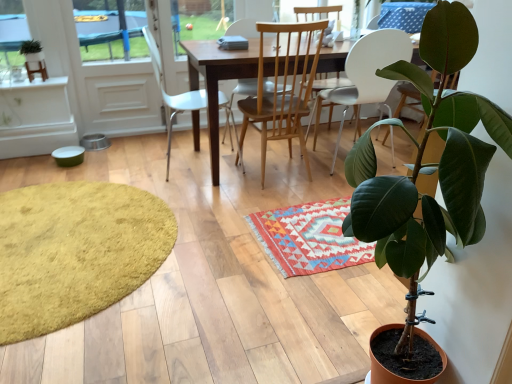
Where is `white plastic chair at center, acting as the 3th chair starting from the right`? white plastic chair at center, acting as the 3th chair starting from the right is located at coordinates (173, 95).

In order to face green matte plant at lower right, which is counted as the 1th houseplant, starting from the right, should I rotate leftwards or rightwards?

It's best to rotate right around 19.354 degrees.

This screenshot has width=512, height=384. What do you see at coordinates (441, 155) in the screenshot?
I see `green matte plant at lower right, the second houseplant from the back` at bounding box center [441, 155].

Identify the location of multicolored woven rug at center, marked as the 2th mat in a left-to-right arrangement. This screenshot has width=512, height=384. (309, 238).

Describe the element at coordinates (309, 238) in the screenshot. The image size is (512, 384). I see `multicolored woven rug at center, which appears as the 1th mat when viewed from the right` at that location.

The image size is (512, 384). Describe the element at coordinates (75, 252) in the screenshot. I see `yellow shaggy rug at lower left, which ranks as the 1th mat in left-to-right order` at that location.

This screenshot has width=512, height=384. What do you see at coordinates (365, 77) in the screenshot? I see `white plastic chair at center, which is the first chair in right-to-left order` at bounding box center [365, 77].

What is the approximate width of green matte plant at upper left, the first houseplant from the top?

3.26 inches.

I want to click on light wood/wooden chair at center, which is counted as the 2th chair, starting from the right, so click(x=282, y=86).

Is white plastic chair at center, positioned as the 3th chair in left-to-right order, beside green matte plant at upper left, the 2th houseplant positioned from the bottom?

No, white plastic chair at center, positioned as the 3th chair in left-to-right order, is not in contact with green matte plant at upper left, the 2th houseplant positioned from the bottom.

Does white plastic chair at center, positioned as the 3th chair in left-to-right order, have a larger size compared to green matte plant at upper left, the 2th houseplant positioned from the bottom?

Yes.

Considering the sizes of white plastic chair at center, which is the first chair in right-to-left order, and green matte plant at upper left, the 2th houseplant viewed from the front, in the image, is white plastic chair at center, which is the first chair in right-to-left order, taller or shorter than green matte plant at upper left, the 2th houseplant viewed from the front,?

In the image, white plastic chair at center, which is the first chair in right-to-left order, appears to be taller than green matte plant at upper left, the 2th houseplant viewed from the front.

Consider the image. From the image's perspective, is white plastic chair at center, which is the first chair in right-to-left order, located above or below green matte plant at upper left, the 2th houseplant viewed from the front?

Clearly, from the image's perspective, white plastic chair at center, which is the first chair in right-to-left order, is below green matte plant at upper left, the 2th houseplant viewed from the front.

Is point (353, 51) farther from camera compared to point (111, 111)?

No, it is not.

Between white plastic chair at center, which is the first chair in right-to-left order, and white glossy screen door at upper left, which one has larger size?

white plastic chair at center, which is the first chair in right-to-left order, is bigger.

Which object is closer to the camera, white plastic chair at center, positioned as the 3th chair in left-to-right order, or white glossy screen door at upper left?

white plastic chair at center, positioned as the 3th chair in left-to-right order, is more forward.

Is white plastic chair at center, positioned as the 3th chair in left-to-right order, in contact with white glossy screen door at upper left?

white plastic chair at center, positioned as the 3th chair in left-to-right order, and white glossy screen door at upper left are clearly separated.

Considering the relative sizes of white glossy screen door at upper left and light wood/wooden chair at center, acting as the 2th chair starting from the left, in the image provided, is white glossy screen door at upper left thinner than light wood/wooden chair at center, acting as the 2th chair starting from the left,?

Indeed, white glossy screen door at upper left has a lesser width compared to light wood/wooden chair at center, acting as the 2th chair starting from the left.

Based on the photo, between white glossy screen door at upper left and light wood/wooden chair at center, acting as the 2th chair starting from the left, which one appears on the right side from the viewer's perspective?

light wood/wooden chair at center, acting as the 2th chair starting from the left.

How many degrees apart are the facing directions of white glossy screen door at upper left and light wood/wooden chair at center, acting as the 2th chair starting from the left?

177 degrees.

Considering the relative sizes of yellow shaggy rug at lower left, which ranks as the 1th mat in left-to-right order, and white glossy screen door at upper left in the image provided, is yellow shaggy rug at lower left, which ranks as the 1th mat in left-to-right order, wider than white glossy screen door at upper left?

Yes.

Based on the photo, is yellow shaggy rug at lower left, which ranks as the 1th mat in left-to-right order, smaller than white glossy screen door at upper left?

Correct, yellow shaggy rug at lower left, which ranks as the 1th mat in left-to-right order, occupies less space than white glossy screen door at upper left.

You are a GUI agent. You are given a task and a screenshot of the screen. Output one action in this format:
    pyautogui.click(x=<x>, y=<y>)
    Task: Click on the mat that is the 1st one below the white glossy screen door at upper left (from a real-world perspective)
    
    Given the screenshot: What is the action you would take?
    pyautogui.click(x=75, y=252)

From the image's perspective, relative to white glossy screen door at upper left, is yellow shaggy rug at lower left, which ranks as the 1th mat in left-to-right order, above or below?

From the image's perspective, yellow shaggy rug at lower left, which ranks as the 1th mat in left-to-right order, appears below white glossy screen door at upper left.

Considering the relative sizes of multicolored woven rug at center, marked as the 2th mat in a left-to-right arrangement, and light wood/wooden chair at center, acting as the 2th chair starting from the left, in the image provided, is multicolored woven rug at center, marked as the 2th mat in a left-to-right arrangement, taller than light wood/wooden chair at center, acting as the 2th chair starting from the left,?

In fact, multicolored woven rug at center, marked as the 2th mat in a left-to-right arrangement, may be shorter than light wood/wooden chair at center, acting as the 2th chair starting from the left.

Locate an element on the screen. the 1st chair behind the multicolored woven rug at center, which appears as the 1th mat when viewed from the right, starting your count from the anchor is located at coordinates (282, 86).

From a real-world perspective, is multicolored woven rug at center, which appears as the 1th mat when viewed from the right, positioned above or below light wood/wooden chair at center, which is counted as the 2th chair, starting from the right?

Clearly, from a real-world perspective, multicolored woven rug at center, which appears as the 1th mat when viewed from the right, is below light wood/wooden chair at center, which is counted as the 2th chair, starting from the right.

Is wooden table at center positioned beyond the bounds of multicolored woven rug at center, which appears as the 1th mat when viewed from the right?

wooden table at center is positioned outside multicolored woven rug at center, which appears as the 1th mat when viewed from the right.

Considering the positions of objects wooden table at center and multicolored woven rug at center, marked as the 2th mat in a left-to-right arrangement, in the image provided, who is in front, wooden table at center or multicolored woven rug at center, marked as the 2th mat in a left-to-right arrangement,?

multicolored woven rug at center, marked as the 2th mat in a left-to-right arrangement, is in front.

Between wooden table at center and multicolored woven rug at center, marked as the 2th mat in a left-to-right arrangement, which one has smaller width?

multicolored woven rug at center, marked as the 2th mat in a left-to-right arrangement, is thinner.

Considering the positions of objects wooden table at center and multicolored woven rug at center, which appears as the 1th mat when viewed from the right, in the image provided, who is more to the left, wooden table at center or multicolored woven rug at center, which appears as the 1th mat when viewed from the right,?

Positioned to the left is multicolored woven rug at center, which appears as the 1th mat when viewed from the right.

From the image's perspective, count 3rd chairs upward from the yellow shaggy rug at lower left, which appears as the second mat when viewed from the right, and point to it. Please provide its 2D coordinates.

[(365, 77)]

From the image's perspective, is white plastic chair at center, which is the first chair in right-to-left order, positioned above or below yellow shaggy rug at lower left, which appears as the second mat when viewed from the right?

Based on their image positions, white plastic chair at center, which is the first chair in right-to-left order, is located above yellow shaggy rug at lower left, which appears as the second mat when viewed from the right.

Considering the relative positions of white plastic chair at center, positioned as the 3th chair in left-to-right order, and yellow shaggy rug at lower left, which appears as the second mat when viewed from the right, in the image provided, is white plastic chair at center, positioned as the 3th chair in left-to-right order, behind yellow shaggy rug at lower left, which appears as the second mat when viewed from the right,?

Yes, white plastic chair at center, positioned as the 3th chair in left-to-right order, is behind yellow shaggy rug at lower left, which appears as the second mat when viewed from the right.

Is white plastic chair at center, which is the first chair in right-to-left order, oriented towards yellow shaggy rug at lower left, which appears as the second mat when viewed from the right?

No, white plastic chair at center, which is the first chair in right-to-left order, is not facing towards yellow shaggy rug at lower left, which appears as the second mat when viewed from the right.

This screenshot has height=384, width=512. What are the coordinates of `the 3rd chair counting from the right of the green matte plant at upper left, which is counted as the 1th houseplant, starting from the left` in the screenshot? It's located at (365, 77).

Find the location of a particular element. screen door that is on the left side of white plastic chair at center, which is the first chair in right-to-left order is located at coordinates (120, 95).

When comparing their distances from light wood/wooden chair at center, which is counted as the 2th chair, starting from the right, does yellow shaggy rug at lower left, which ranks as the 1th mat in left-to-right order, or white glossy screen door at upper left seem closer?

white glossy screen door at upper left is closer to light wood/wooden chair at center, which is counted as the 2th chair, starting from the right.

Which object lies nearer to the anchor point yellow shaggy rug at lower left, which ranks as the 1th mat in left-to-right order, multicolored woven rug at center, marked as the 2th mat in a left-to-right arrangement, or green matte plant at lower right, marked as the first houseplant in a bottom-to-top arrangement?

multicolored woven rug at center, marked as the 2th mat in a left-to-right arrangement.

From the picture: Looking at the image, which one is located closer to green matte plant at lower right, the second houseplant from the back, white plastic chair at center, which is the first chair in right-to-left order, or white plastic chair at center, acting as the 3th chair starting from the right?

The object closer to green matte plant at lower right, the second houseplant from the back, is white plastic chair at center, which is the first chair in right-to-left order.

Looking at the image, which one is located closer to white glossy screen door at upper left, white plastic chair at center, acting as the 3th chair starting from the right, or wooden table at center?

white plastic chair at center, acting as the 3th chair starting from the right.

Considering their positions, is multicolored woven rug at center, which appears as the 1th mat when viewed from the right, positioned closer to white plastic chair at center, placed as the first chair when sorted from left to right, than wooden table at center?

The object closer to white plastic chair at center, placed as the first chair when sorted from left to right, is wooden table at center.

Which object lies further to the anchor point white plastic chair at center, which is the first chair in right-to-left order, white plastic chair at center, placed as the first chair when sorted from left to right, or white glossy screen door at upper left?

The object further to white plastic chair at center, which is the first chair in right-to-left order, is white glossy screen door at upper left.

Looking at the image, which one is located further to green matte plant at lower right, the second houseplant from the back, wooden table at center or white plastic chair at center, which is the first chair in right-to-left order?

white plastic chair at center, which is the first chair in right-to-left order, is positioned further to the anchor green matte plant at lower right, the second houseplant from the back.

When comparing their distances from multicolored woven rug at center, marked as the 2th mat in a left-to-right arrangement, does white plastic chair at center, which is the first chair in right-to-left order, or white plastic chair at center, acting as the 3th chair starting from the right, seem further?

white plastic chair at center, acting as the 3th chair starting from the right, is further to multicolored woven rug at center, marked as the 2th mat in a left-to-right arrangement.

Where is `houseplant between green matte plant at lower right, the 2th houseplant when ordered from top to bottom, and white glossy screen door at upper left in the front-back direction`? The image size is (512, 384). houseplant between green matte plant at lower right, the 2th houseplant when ordered from top to bottom, and white glossy screen door at upper left in the front-back direction is located at coordinates (32, 51).

This screenshot has height=384, width=512. I want to click on screen door between green matte plant at upper left, the first houseplant from the top, and white plastic chair at center, which is the first chair in right-to-left order, from left to right, so click(120, 95).

I want to click on mat between green matte plant at upper left, which ranks as the 2th houseplant in right-to-left order, and multicolored woven rug at center, which appears as the 1th mat when viewed from the right, from left to right, so click(x=75, y=252).

Find the location of a particular element. Image resolution: width=512 pixels, height=384 pixels. chair positioned between green matte plant at lower right, the 2th houseplant when ordered from top to bottom, and wooden table at center from near to far is located at coordinates (282, 86).